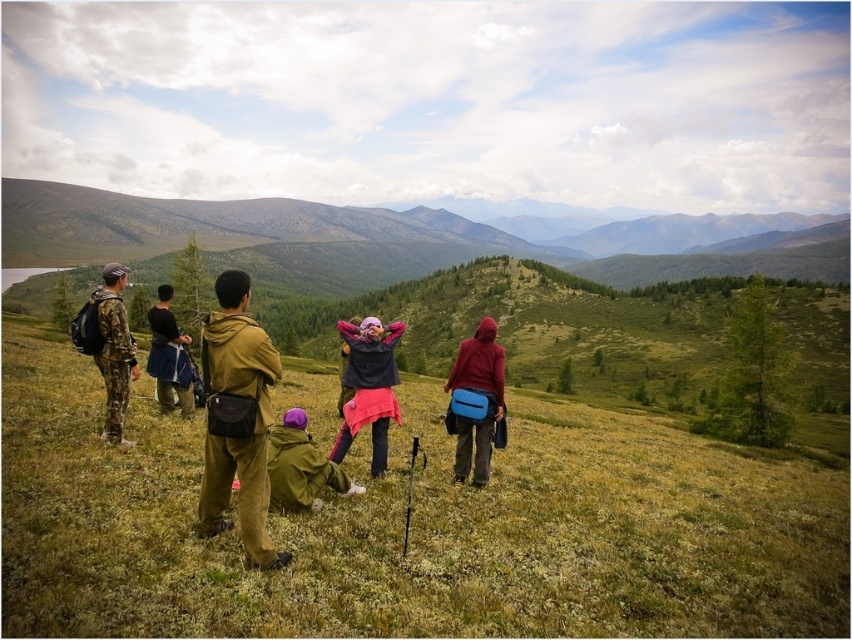
You are a photographer trying to capture the entire group standing on the green grassy hill at upper center and the brown corduroy jacket at center. Based on their relative heights, which object should you focus on to ensure the group is fully visible in the photo?

The green grassy hill at upper center is much taller than the brown corduroy jacket at center, so focusing on the green grassy hill at upper center would ensure the group is fully visible in the photo.

You are a photographer positioned at the center of the scene. You want to capture a photo that includes both the camouflage pants at left and the dark blue fabric jacket at center. Given that your camera has a maximum focal length that allows capturing objects up to 6 feet apart, will you be able to include both subjects in the same frame?

The distance between the camouflage pants at left and the dark blue fabric jacket at center is 6.31 feet. Since the maximum focal length allows capturing objects up to 6 feet apart, the distance is slightly beyond the camera capability. Therefore, you cannot include both subjects in the same frame.